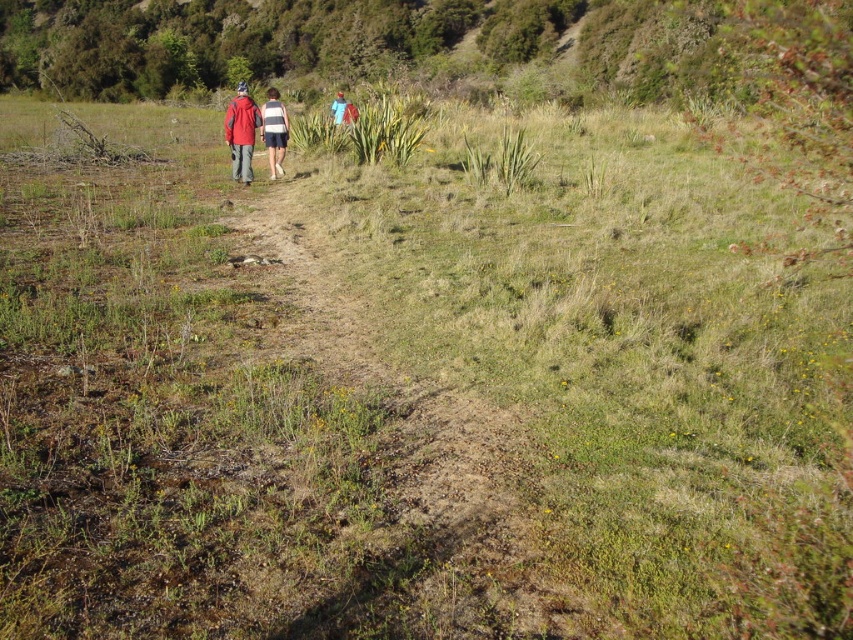
You are navigating through the grassy area along the dirt path and see two points marked in the scene. Which point, point (x=270, y=99) or point (x=276, y=120), is located further away from your current position?

Point (x=270, y=99) is behind point (x=276, y=120), so it is further away from your current position.

You are a hiker trying to navigate to the top of the hill. You have two paths in front of you, the green grassy hillside at upper center and the dried grass at center. Which path should you take to reach the top of the hill?

The green grassy hillside at upper center is located above the dried grass at center, so you should take the green grassy hillside at upper center to reach the top of the hill.